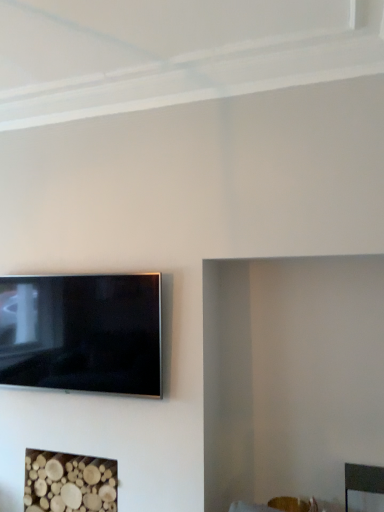
Question: From the image's perspective, is matte black tv at lower left above or below wooden logs at lower left?

Choices:
 (A) above
 (B) below

Answer: (A)

Question: In the image, is matte black tv at lower left positioned in front of or behind wooden logs at lower left?

Choices:
 (A) behind
 (B) front

Answer: (B)

Question: Considering the relative positions of matte black tv at lower left and wooden logs at lower left in the image provided, is matte black tv at lower left to the left or to the right of wooden logs at lower left?

Choices:
 (A) right
 (B) left

Answer: (B)

Question: From a real-world perspective, is wooden logs at lower left above or below matte black tv at lower left?

Choices:
 (A) below
 (B) above

Answer: (A)

Question: From the image's perspective, is wooden logs at lower left positioned above or below matte black tv at lower left?

Choices:
 (A) below
 (B) above

Answer: (A)

Question: Is wooden logs at lower left situated inside matte black tv at lower left or outside?

Choices:
 (A) outside
 (B) inside

Answer: (A)

Question: Visually, is wooden logs at lower left positioned to the left or to the right of matte black tv at lower left?

Choices:
 (A) left
 (B) right

Answer: (B)